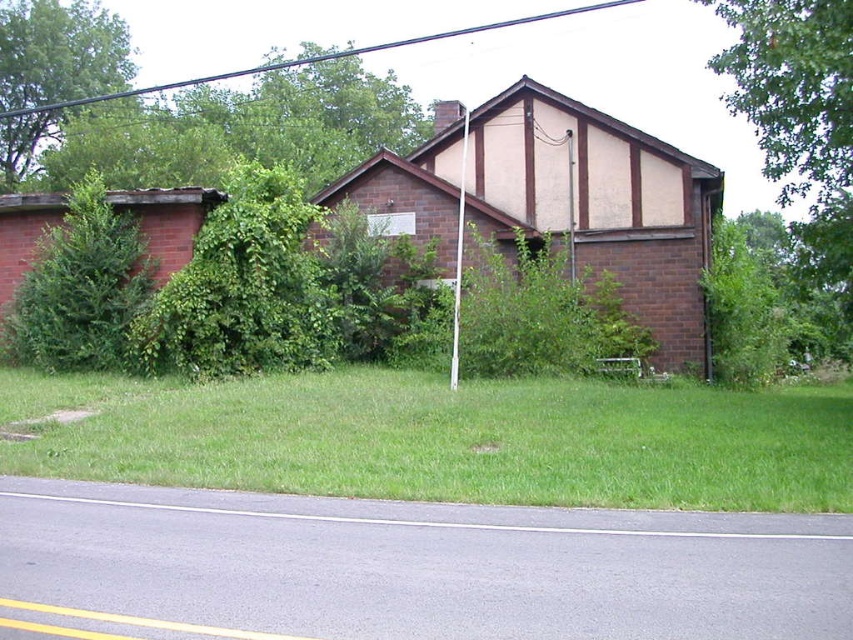
You are standing in front of the two story brick building and want to find the tree that is closer to the ground. Which tree is it between the green leafy tree at left and the green leafy tree at upper left?

The green leafy tree at left is located below the green leafy tree at upper left, so it is closer to the ground.

You are standing at the point marked as point (445, 438) in the image. What is the immediate surface you are standing on?

The immediate surface at point (445, 438) is green grass at lower center.

You are a landscape architect planning to install a new sprinkler system. The sprinkler has a maximum range of 18 meters. You need to water the green leafy tree at left. Can the sprinkler reach the tree from its current position?

The green leafy tree at left is 17.70 meters from the camera, so yes, the sprinkler can reach it since its maximum range is 18 meters.